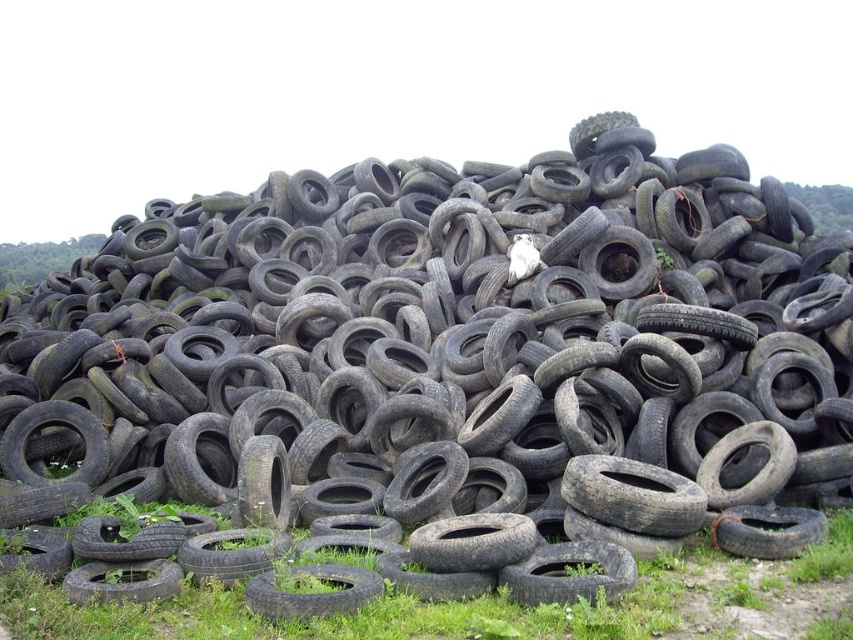
You are a gardener trying to plant flowers between the green grass at lower center and the black rubber tire at center. How much space do you have to work with?

The green grass at lower center is 3.56 feet away from the black rubber tire at center, so you have 3.56 feet of space to work with between them.

You are a gardener trying to plant a new flower bed. You see the green grass at lower center and the black rubber tire at lower center in the scene. Which one takes up more space in the area?

The green grass at lower center has a larger size compared to the black rubber tire at lower center, so the green grass at lower center takes up more space in the area.